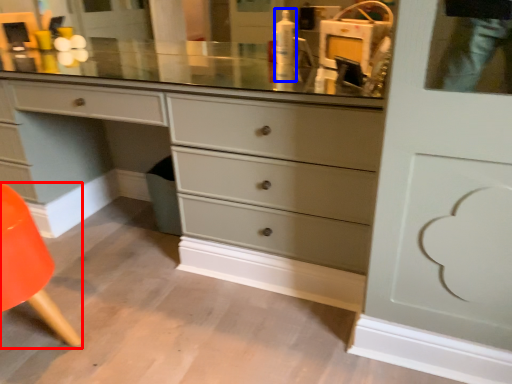
Question: Which of the following is the farthest to the observer, armchair (highlighted by a red box) or toiletry (highlighted by a blue box)?

Choices:
 (A) armchair
 (B) toiletry

Answer: (B)